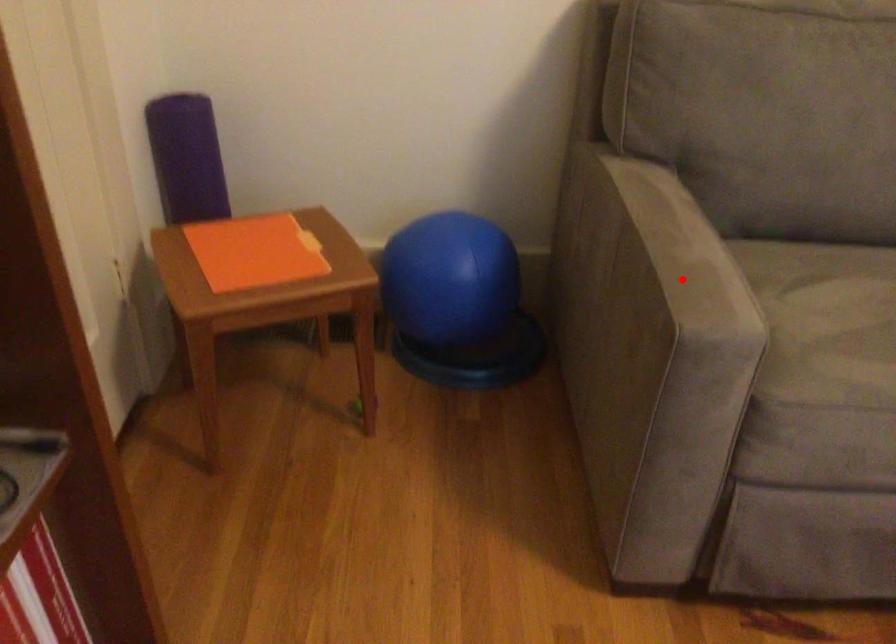
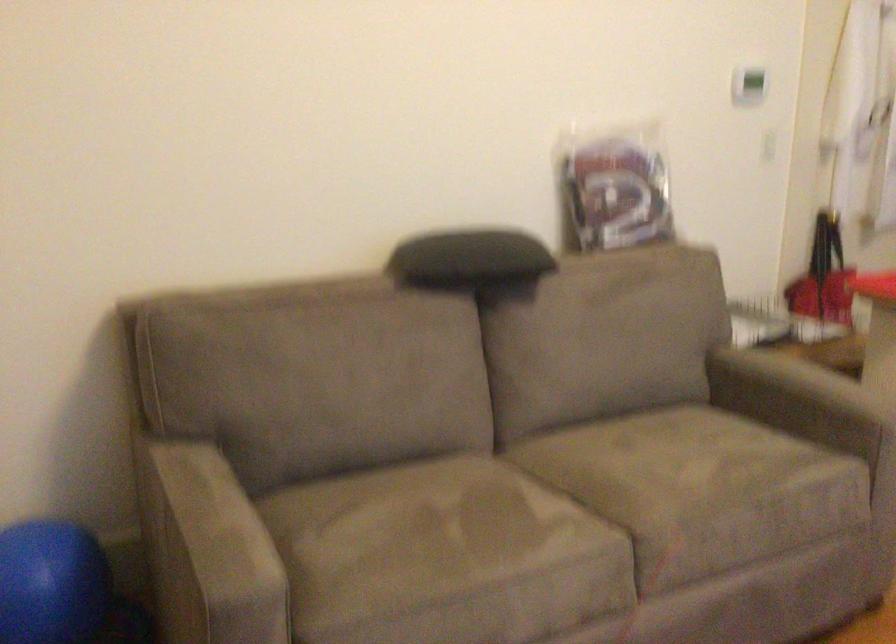
Question: I am providing you with two images of the same scene from different viewpoints. In image1, a red point is highlighted. Considering the same 3D point in image2, which of the following is correct?

Choices:
 (A) It is closer
 (B) It is farther

Answer: (B)